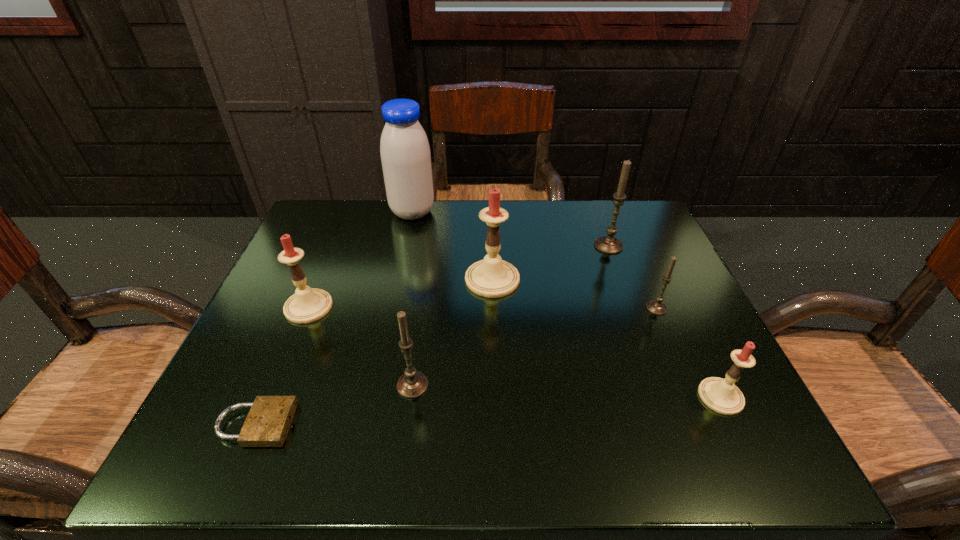
In order to click on object that is positioned at the near right corner in this screenshot , I will do `click(721, 395)`.

Where is `free space at the far edge of the desktop`? free space at the far edge of the desktop is located at coordinates (446, 201).

At what (x,y) coordinates should I click in order to perform the action: click on free space at the near edge of the desktop. Please return your answer as a coordinate pair (x, y). Image resolution: width=960 pixels, height=540 pixels. Looking at the image, I should click on (446, 430).

The image size is (960, 540). I want to click on free space at the left edge of the desktop, so click(x=257, y=331).

Identify the location of vacant space at the right edge of the desktop. (660, 286).

At what (x,y) coordinates should I click in order to perform the action: click on vacant space at the far left corner of the desktop. Please return your answer as a coordinate pair (x, y). The width and height of the screenshot is (960, 540). Looking at the image, I should click on (361, 214).

Find the location of a particular element. The image size is (960, 540). vacant space at the near left corner is located at coordinates (207, 415).

In the image, there is a desktop. Where is `vacant space at the far right corner`? vacant space at the far right corner is located at coordinates (666, 249).

Identify the location of free space at the near right corner of the desktop. (718, 425).

Locate an element on the screen. Image resolution: width=960 pixels, height=540 pixels. free space between the leftmost candle and the tallest object is located at coordinates (361, 260).